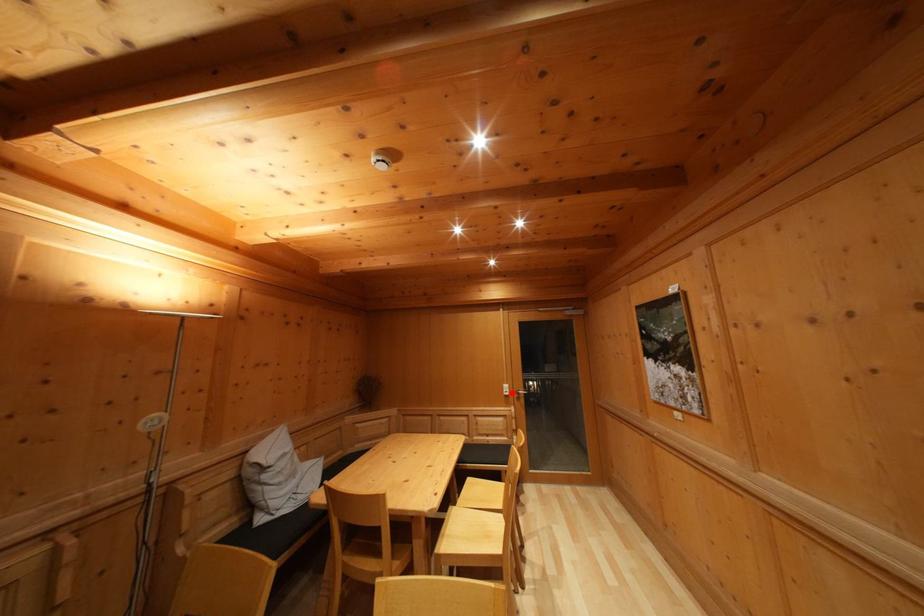
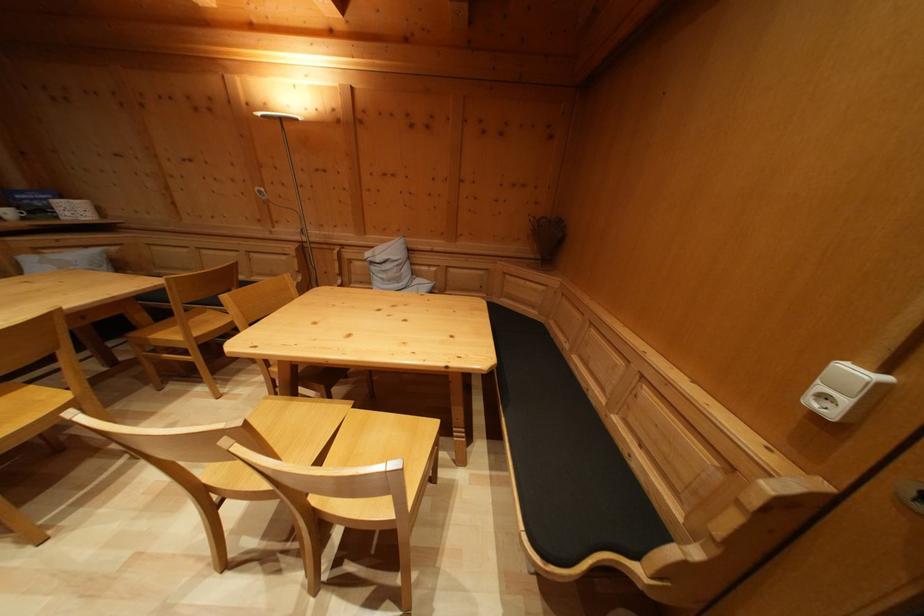
Find the pixel in the second image that matches the highlighted location in the first image.

(859, 379)